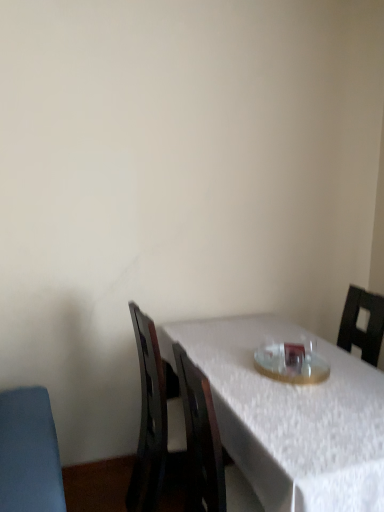
Question: Relative to clear glass plate at center, is white textured table at center in front or behind?

Choices:
 (A) front
 (B) behind

Answer: (A)

Question: Based on their positions, is white textured table at center located to the left or right of clear glass plate at center?

Choices:
 (A) right
 (B) left

Answer: (B)

Question: Considering the positions of white textured table at center and clear glass plate at center in the image, is white textured table at center wider or thinner than clear glass plate at center?

Choices:
 (A) wide
 (B) thin

Answer: (A)

Question: Considering the positions of clear glass plate at center and white textured table at center in the image, is clear glass plate at center wider or thinner than white textured table at center?

Choices:
 (A) wide
 (B) thin

Answer: (B)

Question: Is point (314, 352) closer or farther from the camera than point (316, 467)?

Choices:
 (A) closer
 (B) farther

Answer: (B)

Question: From their relative heights in the image, would you say clear glass plate at center is taller or shorter than white textured table at center?

Choices:
 (A) tall
 (B) short

Answer: (B)

Question: In terms of size, does clear glass plate at center appear bigger or smaller than white textured table at center?

Choices:
 (A) big
 (B) small

Answer: (B)